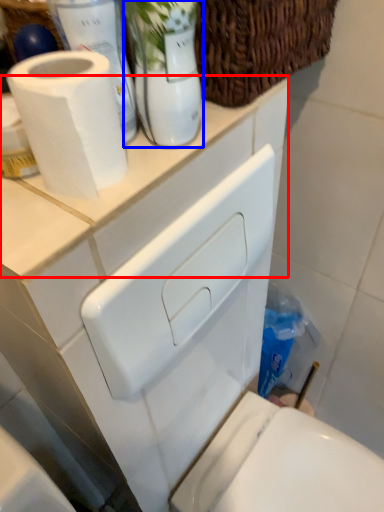
Question: Which of the following is the farthest to the observer, counter top (highlighted by a red box) or glass vase (highlighted by a blue box)?

Choices:
 (A) counter top
 (B) glass vase

Answer: (A)